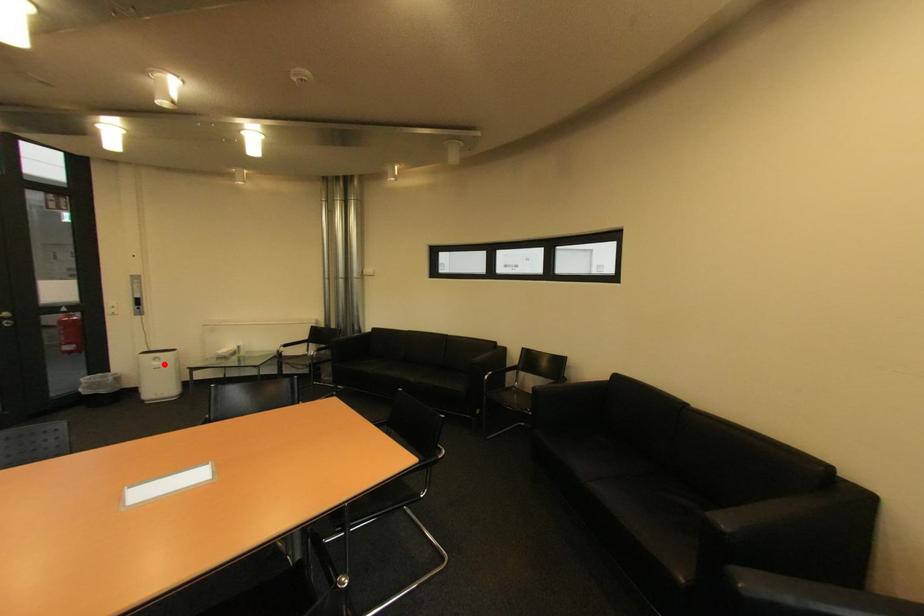
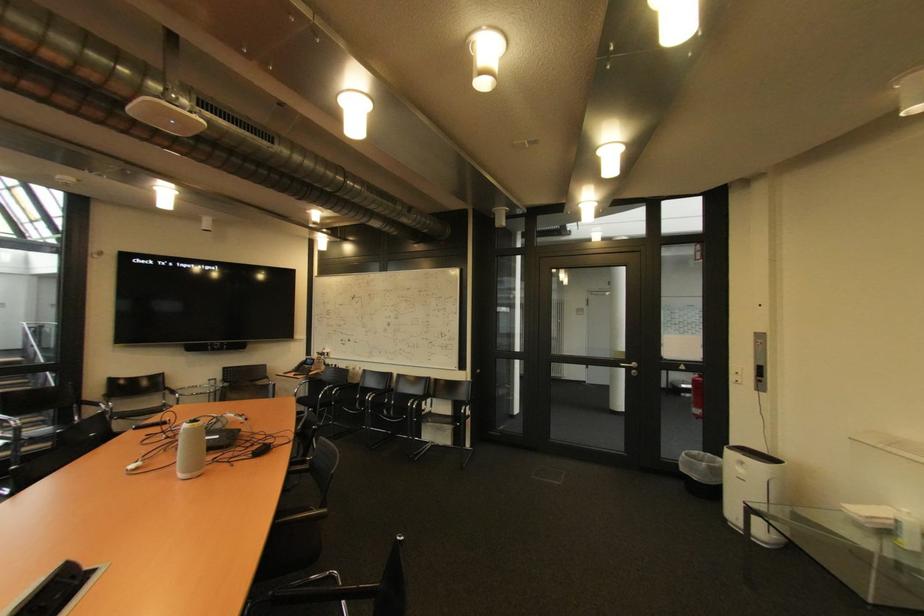
Question: I am providing you with two images of the same scene from different viewpoints. A red point is marked on the first image. Can you still see the location of the red point in image 2?

Choices:
 (A) Yes
 (B) No

Answer: (A)